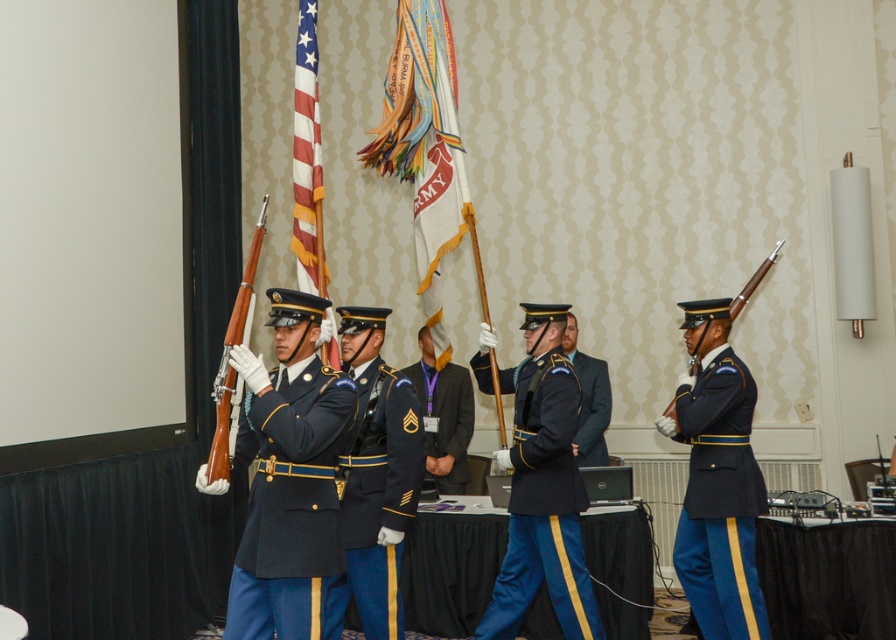
Can you confirm if shiny blue fabric uniform at right is positioned to the right of american flag at center?

Correct, you'll find shiny blue fabric uniform at right to the right of american flag at center.

Does shiny blue fabric uniform at right lie behind american flag at center?

No, shiny blue fabric uniform at right is in front of american flag at center.

Who is more distant from viewer, (747, 634) or (303, 289)?

Point (303, 289)

Identify the location of shiny blue fabric uniform at right. The image size is (896, 640). (720, 500).

Who is positioned more to the left, dark blue fabric uniform at center or wooden rifle at left?

wooden rifle at left

Find the location of a particular element. dark blue fabric uniform at center is located at coordinates (446, 419).

Who is more distant from viewer, [317,259] or [226,392]?

The point [317,259] is more distant.

Does american flag at center have a greater height compared to wooden rifle at left?

Indeed, american flag at center has a greater height compared to wooden rifle at left.

The width and height of the screenshot is (896, 640). I want to click on american flag at center, so click(x=307, y=160).